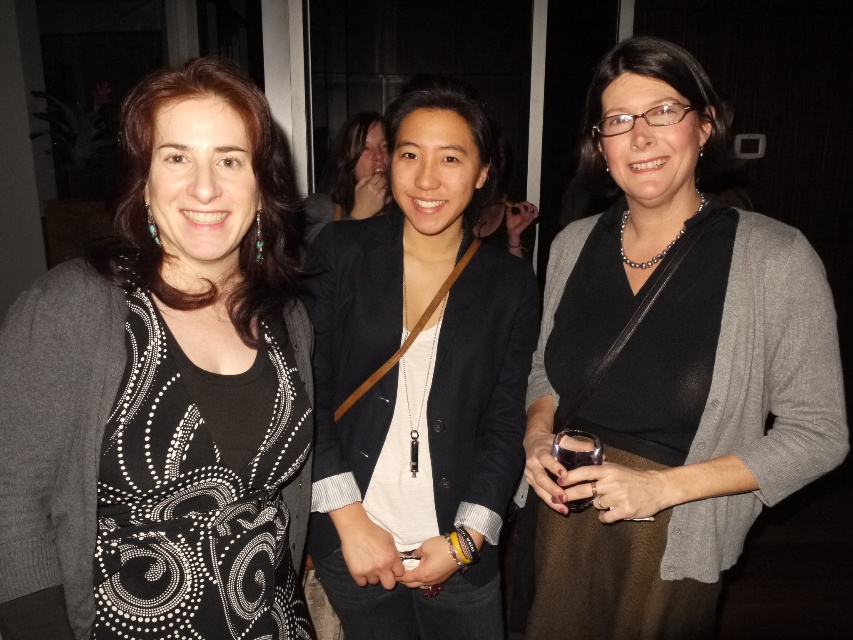
You are at the center of the room and want to find the black matte dress at center. Based on the coordinates provided, in which direction should you look to locate it?

The black matte dress at center is located at coordinates point [167,390], which places it slightly to the right and lower from the center of the room. You should look towards the lower right direction to find it.

You are at a party and want to describe the clothing of the two women at the center. Which clothing item is positioned lower on their body between the black matte dress at center and the matte black blazer at center?

The black matte dress at center is positioned lower on their body than the matte black blazer at center, which is worn over the dress.